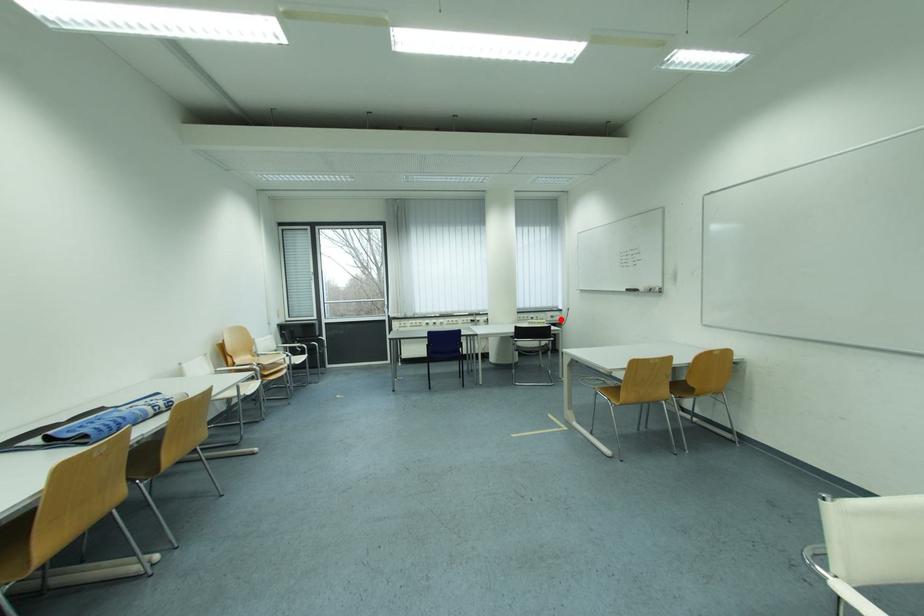
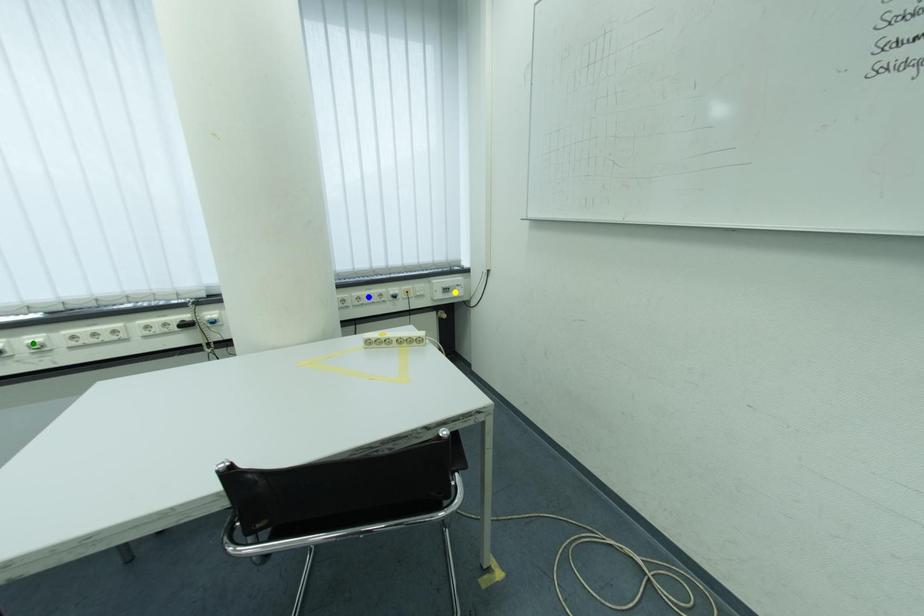
Question: I am providing you with two images of the same scene from different viewpoints. A red point is marked on the first image. You are given multiple points on the second image. Which point in image 2 represents the same 3d spot as the red point in image 1?

Choices:
 (A) yellow point
 (B) green point
 (C) blue point

Answer: (A)